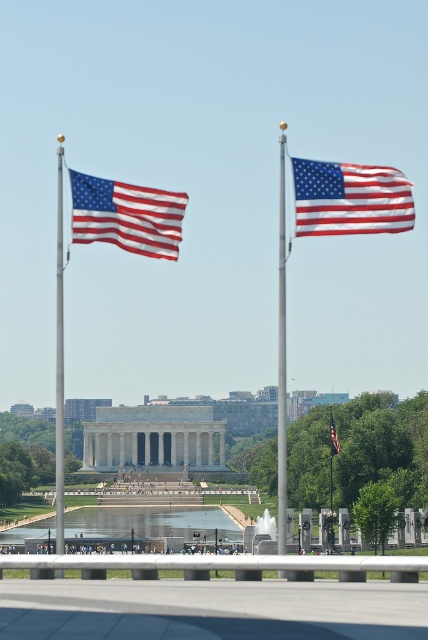
You are a photographer planning to capture the Lincoln Memorial with both the matte fabric flag at left and the matte fabric flag at center in your shot. Which flag will appear larger in your photo?

The matte fabric flag at center will appear larger in the photo because it is larger in size compared to the matte fabric flag at left.

You are standing at the base of the Lincoln Memorial and want to take a photo of the matte fabric flag at left. If your camera has a maximum focus range of 40 meters, will it be able to capture the flag clearly?

The matte fabric flag at left is 43.86 meters away from the camera, which exceeds the camera maximum focus range of 40 meters. Therefore, the camera will not be able to capture the flag clearly.